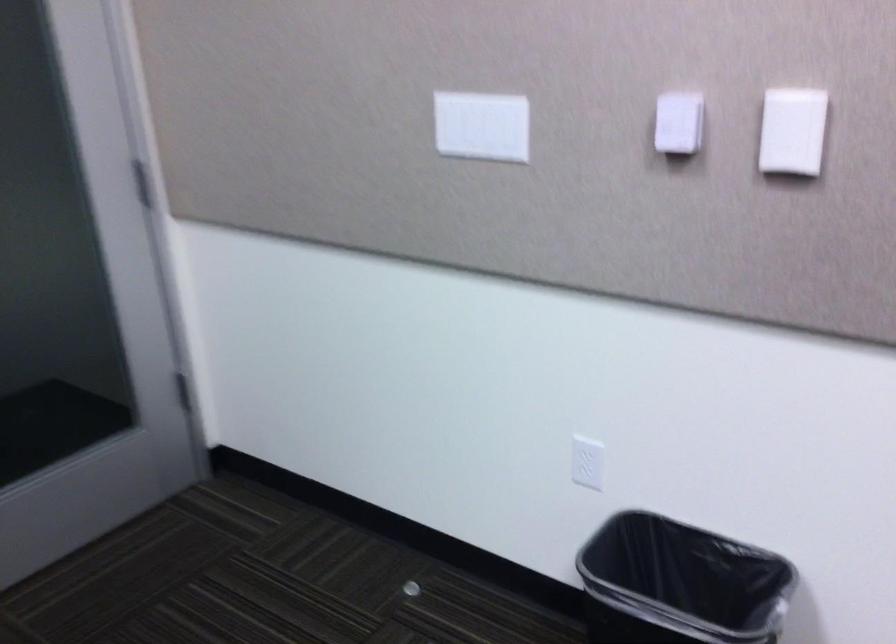
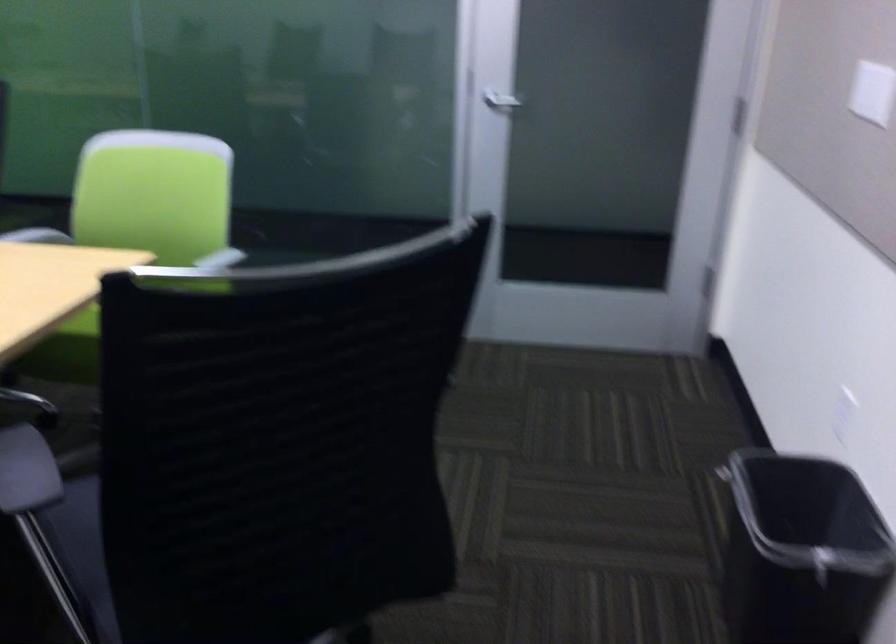
In the second image, find the point that corresponds to (477,138) in the first image.

(872, 91)